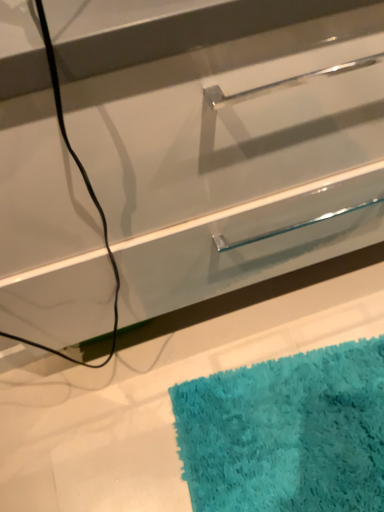
Identify the location of vacant area situated to the left side of turquoise shaggy bath mat at lower right. (115, 420).